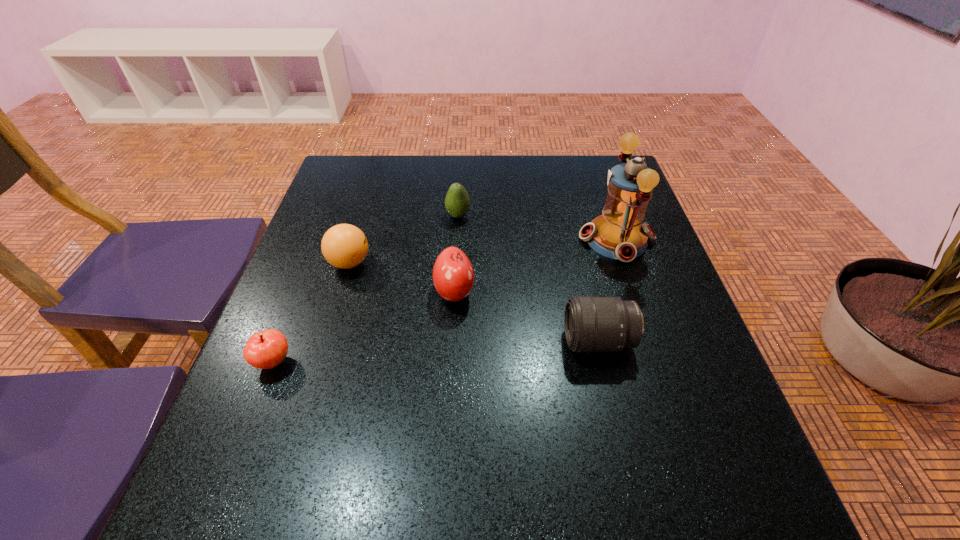
At what (x,y) coordinates should I click in order to perform the action: click on lantern positioned at the right edge. Please return your answer as a coordinate pair (x, y). This screenshot has height=540, width=960. Looking at the image, I should click on (618, 233).

Where is `telephoto lens located in the right edge section of the desktop`? The width and height of the screenshot is (960, 540). telephoto lens located in the right edge section of the desktop is located at coordinates (592, 324).

Where is `vacant space at the far edge of the desktop`? The height and width of the screenshot is (540, 960). vacant space at the far edge of the desktop is located at coordinates (563, 169).

This screenshot has width=960, height=540. I want to click on vacant region at the near edge of the desktop, so click(x=504, y=500).

Find the location of a particular element. The height and width of the screenshot is (540, 960). free space at the left edge of the desktop is located at coordinates click(x=372, y=232).

The width and height of the screenshot is (960, 540). In order to click on free space at the right edge of the desktop in this screenshot , I will do `click(630, 268)`.

You are a GUI agent. You are given a task and a screenshot of the screen. Output one action in this format:
    pyautogui.click(x=<x>, y=<y>)
    Task: Click on the vacant space at the far left corner of the desktop
    
    Given the screenshot: What is the action you would take?
    pyautogui.click(x=332, y=183)

Identify the location of free spot at the near right corner of the desktop. (760, 482).

Locate an element on the screen. This screenshot has width=960, height=540. unoccupied area between the shortest object and the farther apple is located at coordinates (364, 327).

The height and width of the screenshot is (540, 960). I want to click on empty location between the ping-pong ball and the avocado, so click(x=404, y=239).